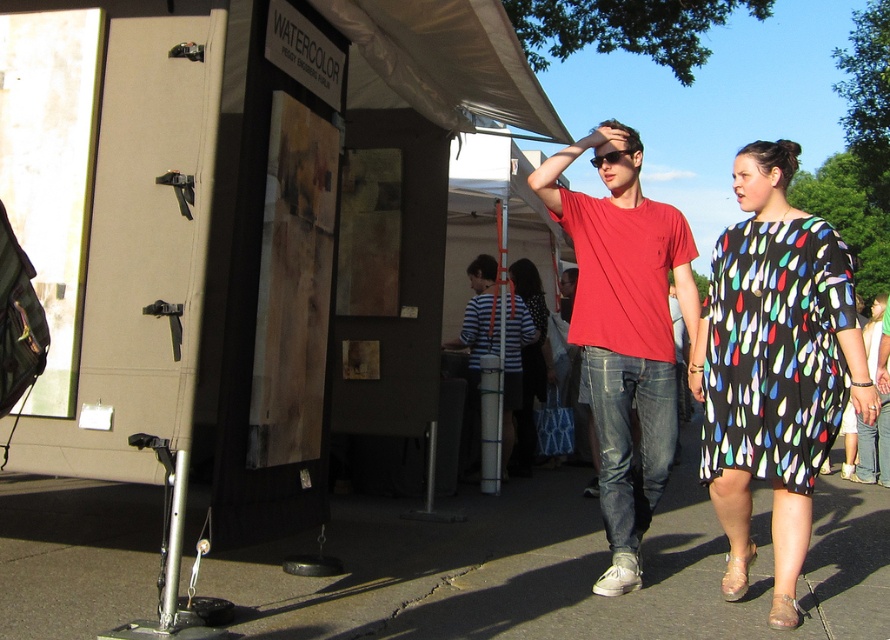
You are an event organizer at the art fair and need to decide which dress to display in a narrow display case. The case can only accommodate the narrower of the two dresses. Which dress should you choose between the black printed dress at center and the striped fabric dress at center?

The striped fabric dress at center is narrower than the black printed dress at center, so you should choose the striped fabric dress at center for the narrow display case.

You are standing at the entrance of the WATERCOLOR booth and see a point marked at coordinates [774,368]. Which object in the scene does this point belong to?

The point at coordinates [774,368] belongs to the black printed dress at center.

From the picture: You are standing at the entrance of the WATERCOLOR booth and want to step onto the gray asphalt pavement at center. However, there is a striped fabric dress at center in your path. Can you walk directly to the pavement without stepping on the dress?

The gray asphalt pavement at center is closer to the viewer than the striped fabric dress at center, so you can walk directly to the pavement without stepping on the dress because the dress is behind the pavement.